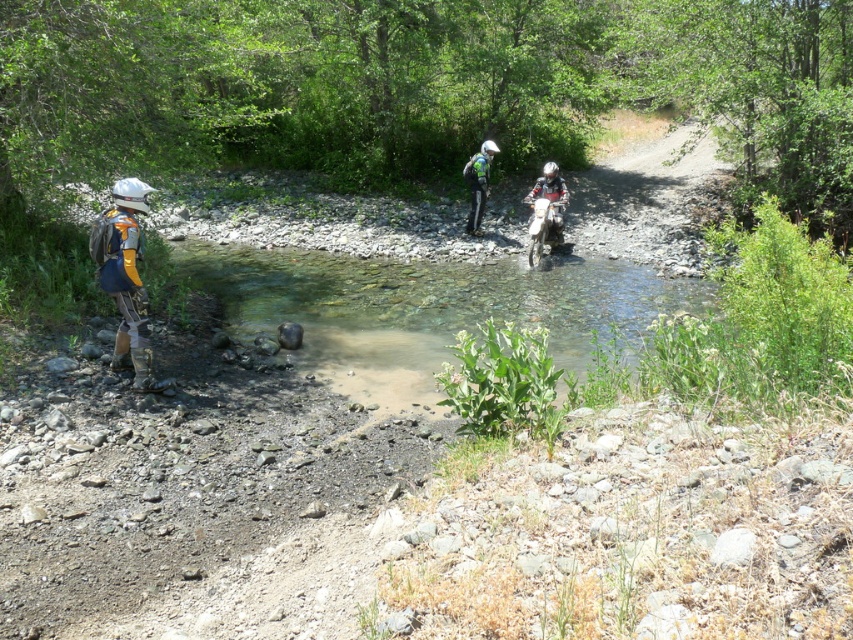
Who is higher up, clear water at center or matte silver helmet at left?

matte silver helmet at left

Is point (401, 296) closer to camera compared to point (123, 358)?

No, (401, 296) is further to viewer.

Locate an element on the screen. The height and width of the screenshot is (640, 853). clear water at center is located at coordinates (434, 304).

Which is more to the left, green matte helmet at center or white matte motorcycle at center?

green matte helmet at center is more to the left.

Based on the photo, is green matte helmet at center further to camera compared to white matte motorcycle at center?

Yes, green matte helmet at center is further from the viewer.

Is point (480, 148) closer to viewer compared to point (550, 182)?

No, it is not.

Image resolution: width=853 pixels, height=640 pixels. What are the coordinates of `green matte helmet at center` in the screenshot? It's located at (479, 182).

Does clear water at center appear over white matte motorcycle at center?

Incorrect, clear water at center is not positioned above white matte motorcycle at center.

Who is more forward, (399,317) or (564,189)?

Positioned in front is point (399,317).

Is point (303, 336) behind point (561, 220)?

No, (303, 336) is closer to viewer.

The image size is (853, 640). I want to click on clear water at center, so click(434, 304).